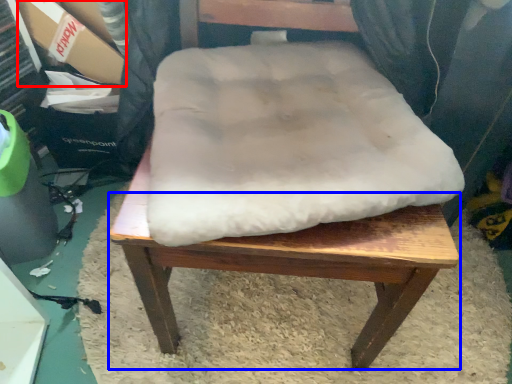
Question: Which object is closer to the camera taking this photo, cardboard box (highlighted by a red box) or step stool (highlighted by a blue box)?

Choices:
 (A) cardboard box
 (B) step stool

Answer: (B)